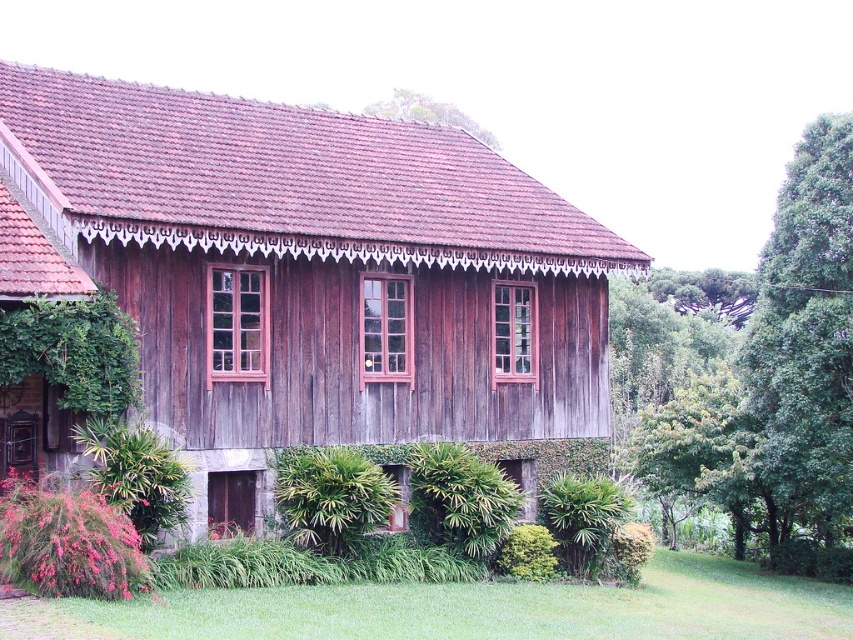
Question: Can you confirm if green leafy plant at lower center is positioned above green leafy tree at upper center?

Choices:
 (A) no
 (B) yes

Answer: (A)

Question: Which of the following is the closest to the observer?

Choices:
 (A) [386, 108]
 (B) [469, 140]
 (C) [734, 451]
 (D) [373, 474]

Answer: (D)

Question: Is green leafy tree at right wider than green leafy plant at lower center?

Choices:
 (A) no
 (B) yes

Answer: (B)

Question: Which object is farther from the camera taking this photo?

Choices:
 (A) green leafy tree at right
 (B) green leafy tree at upper center

Answer: (B)

Question: Is the position of weathered wood house at center more distant than that of green leafy tree at right?

Choices:
 (A) no
 (B) yes

Answer: (A)

Question: Among these objects, which one is nearest to the camera?

Choices:
 (A) green leafy plant at lower center
 (B) green leafy tree at right
 (C) green leafy tree at upper center

Answer: (A)